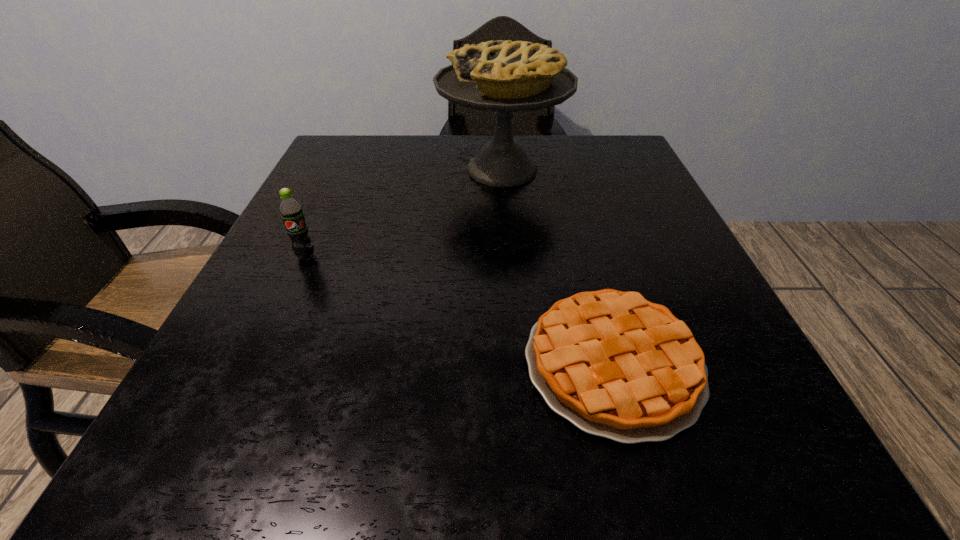
I want to click on vacant point located between the shortest object and the farthest object, so click(558, 267).

Identify the location of empty space that is in between the shorter pie and the leftmost object. (460, 310).

At what (x,y) coordinates should I click in order to perform the action: click on empty location between the shortest object and the second tallest object. Please return your answer as a coordinate pair (x, y). The height and width of the screenshot is (540, 960). Looking at the image, I should click on (460, 310).

Locate an element on the screen. The height and width of the screenshot is (540, 960). vacant area between the soda and the nearer pie is located at coordinates (460, 310).

Where is `free area in between the second farthest object and the shorter pie`? free area in between the second farthest object and the shorter pie is located at coordinates tap(460, 310).

You are a GUI agent. You are given a task and a screenshot of the screen. Output one action in this format:
    pyautogui.click(x=<x>, y=<y>)
    Task: Click on the empty location between the shortest object and the farther pie
    The height and width of the screenshot is (540, 960).
    Given the screenshot: What is the action you would take?
    pyautogui.click(x=558, y=267)

The width and height of the screenshot is (960, 540). In order to click on free space that is in between the farther pie and the shorter pie in this screenshot , I will do `click(558, 267)`.

Locate an element on the screen. vacant area between the shorter pie and the farther pie is located at coordinates (x=558, y=267).

Locate an element on the screen. The height and width of the screenshot is (540, 960). free point between the farther pie and the second tallest object is located at coordinates (404, 213).

Locate an element on the screen. This screenshot has width=960, height=540. unoccupied position between the nearer pie and the tallest object is located at coordinates (558, 267).